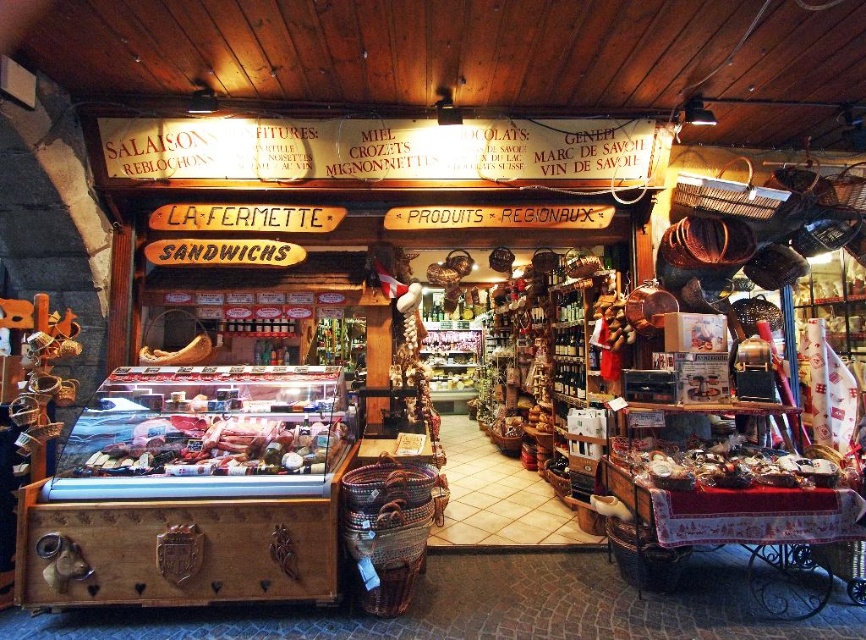
You are a customer in the shop and want to choose between the shiny pink meat at center and the matte brown cheese at center left. Which item is wider?

The shiny pink meat at center is wider than the matte brown cheese at center left because its width is larger.

Consider the image. You are a customer in the shop and want to buy both the shiny pink meat at center and the matte brown cheese at center left. Which item is located lower on the display case?

The shiny pink meat at center is located lower than the matte brown cheese at center left in the display case.